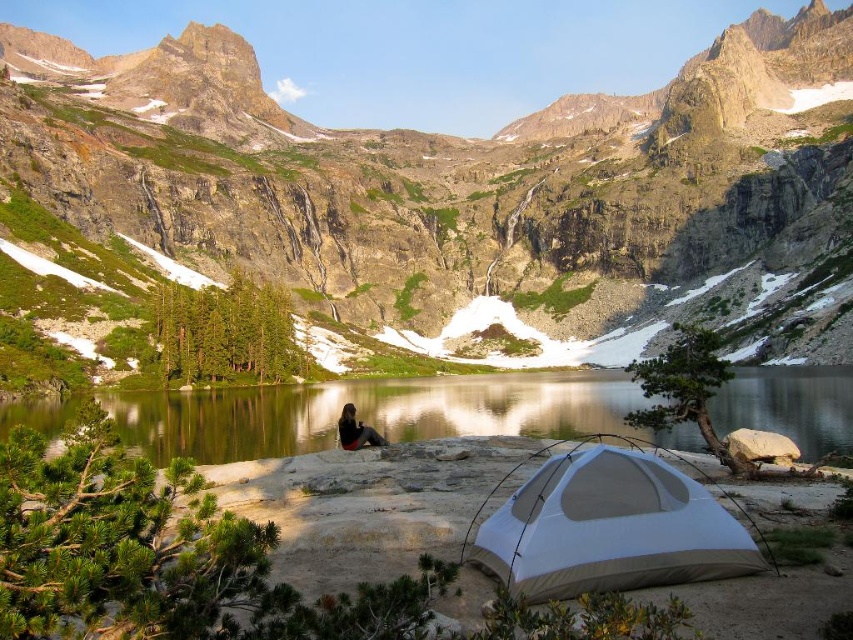
You are a hiker planning to set up a campsite near the black fabric person at center. The white fabric tent at lower right is already set up. Based on the scene, can you determine if the tent is positioned higher or lower than your current location?

The white fabric tent at lower right is below the black fabric person at center, so the tent is positioned lower than your current location.

You are standing at the point where the person is sitting on the rocks. The rocky cliff at center is represented by point (422, 172). What direction should you move to reach the rocky cliff at center?

To reach the rocky cliff at center, you should move towards the point (422, 172) from your current position where you are sitting on the rocks.